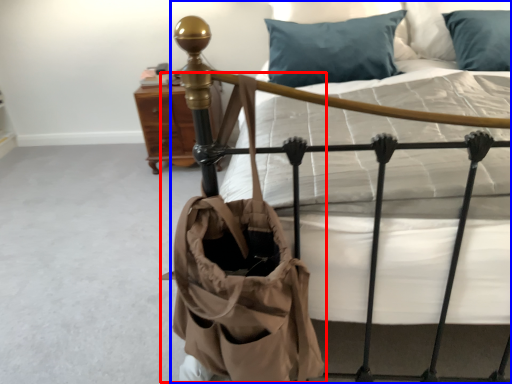
Question: Which point is further to the camera, shoulder bag (highlighted by a red box) or bed (highlighted by a blue box)?

Choices:
 (A) shoulder bag
 (B) bed

Answer: (B)